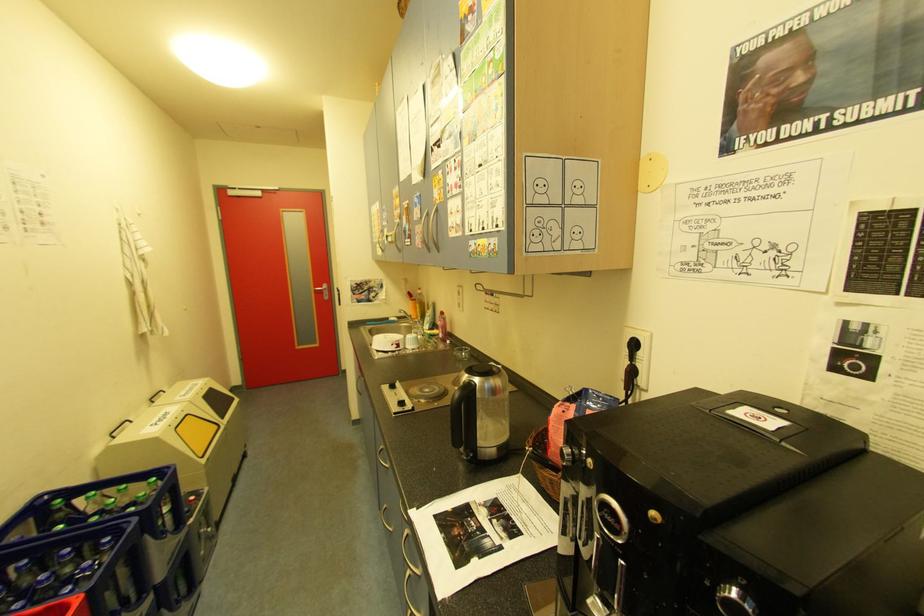
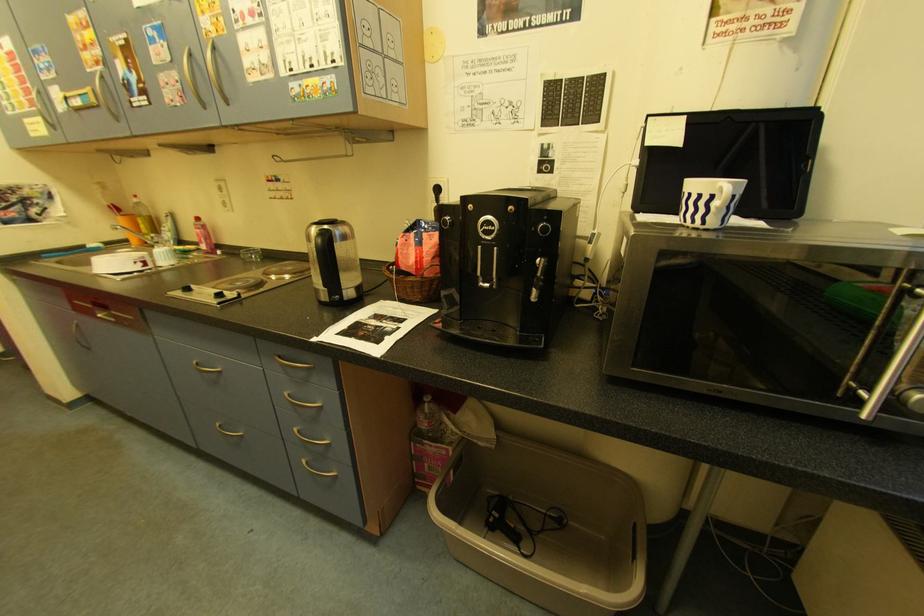
Question: The camera is either moving clockwise (left) or counter-clockwise (right) around the object. The first image is from the beginning of the video and the second image is from the end. Is the camera moving left or right when shooting the video?

Choices:
 (A) Left
 (B) Right

Answer: (A)